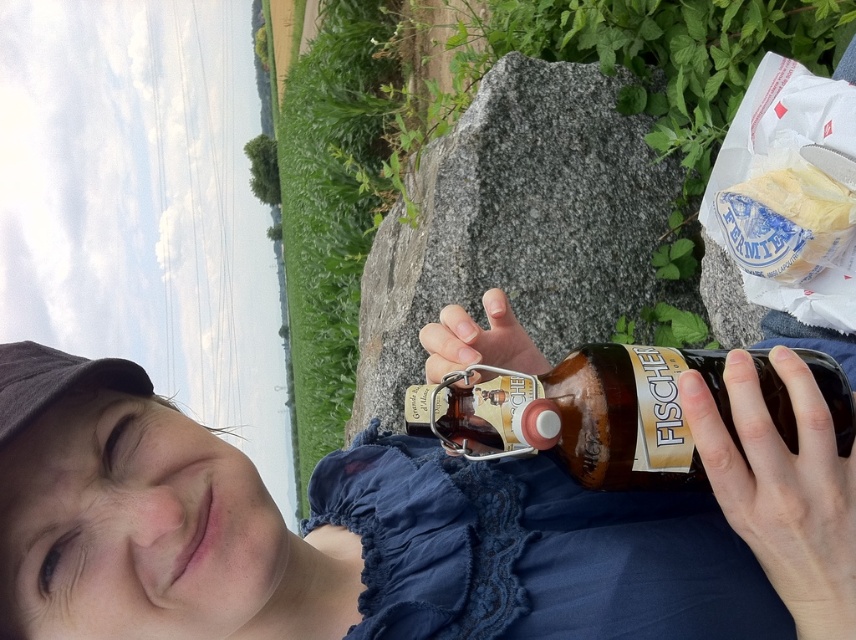
Question: Does matte blue dress at lower center have a larger size compared to brown glass bottle at center?

Choices:
 (A) no
 (B) yes

Answer: (B)

Question: Which object is the farthest from the brown rock at center?

Choices:
 (A) matte blue dress at lower center
 (B) brown glass bottle at center

Answer: (B)

Question: Which point is closer to the camera?

Choices:
 (A) [610, 381]
 (B) [628, 205]
 (C) [259, 628]

Answer: (A)

Question: Does matte blue dress at lower center appear under brown rock at center?

Choices:
 (A) yes
 (B) no

Answer: (A)

Question: Based on their relative distances, which object is farther from the brown glass bottle at center?

Choices:
 (A) matte blue dress at lower center
 (B) brown rock at center

Answer: (B)

Question: Can you confirm if brown rock at center is thinner than brown glass bottle at center?

Choices:
 (A) yes
 (B) no

Answer: (B)